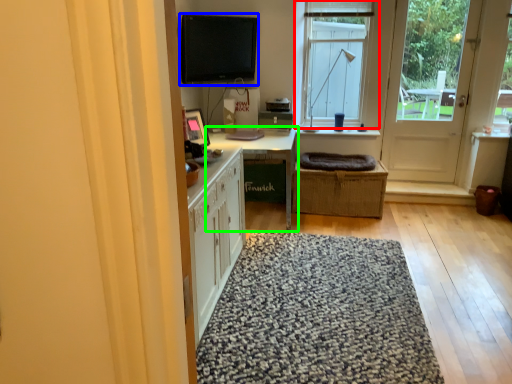
Question: Which is nearer to the window (highlighted by a red box)? computer monitor (highlighted by a blue box) or table (highlighted by a green box).

Choices:
 (A) computer monitor
 (B) table

Answer: (A)